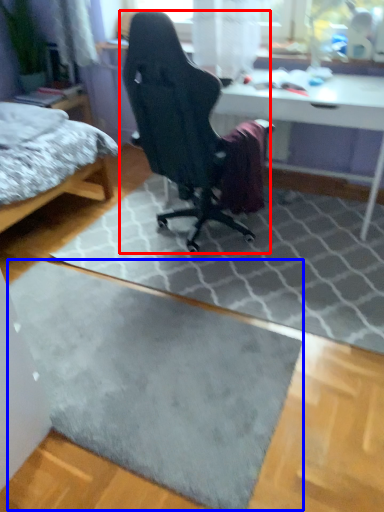
Question: Which of the following is the farthest to the observer, chair (highlighted by a red box) or doormat (highlighted by a blue box)?

Choices:
 (A) chair
 (B) doormat

Answer: (A)